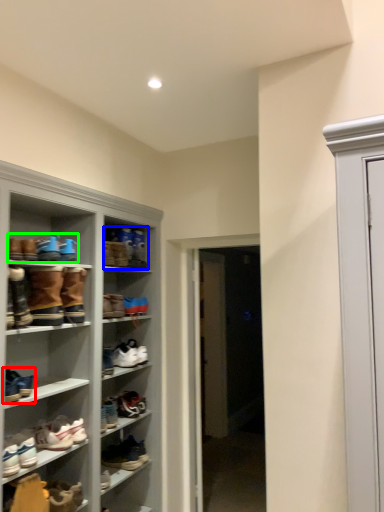
Question: Which object is the closest to the footwear (highlighted by a red box)? Choose among these: footwear (highlighted by a blue box) or footwear (highlighted by a green box).

Choices:
 (A) footwear
 (B) footwear

Answer: (B)